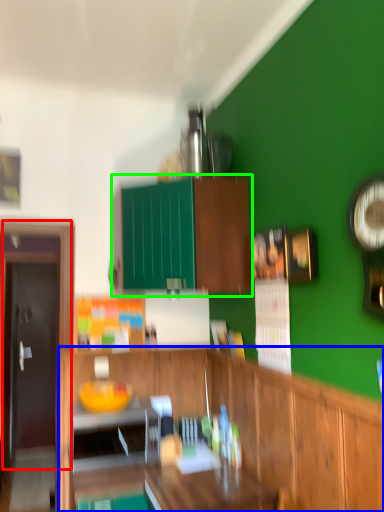
Question: Considering the real-world distances, which object is farthest from door (highlighted by a red box)? cabinetry (highlighted by a blue box) or cabinetry (highlighted by a green box)?

Choices:
 (A) cabinetry
 (B) cabinetry

Answer: (A)